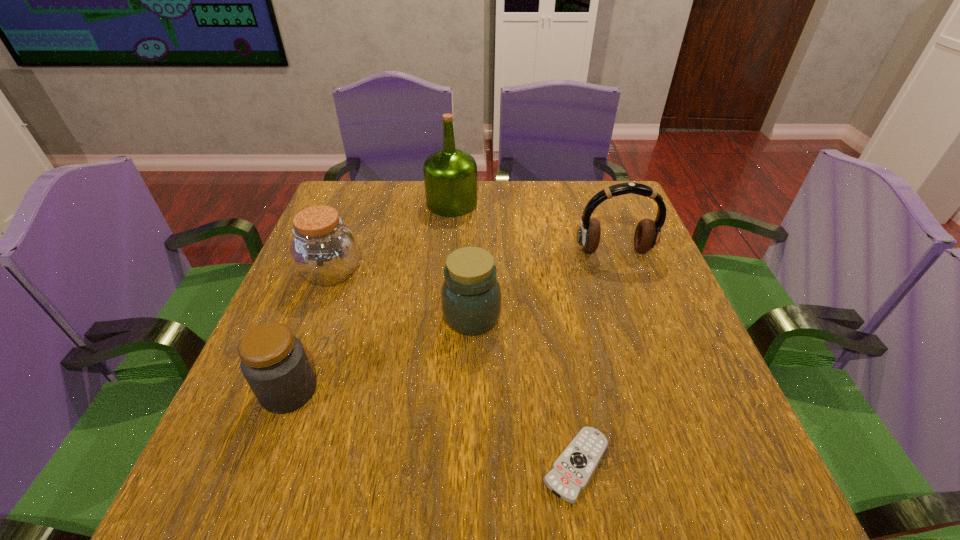
Where is `free spot located on the front of the tallest object`? free spot located on the front of the tallest object is located at coordinates (444, 286).

The height and width of the screenshot is (540, 960). Find the location of `free space located 0.200m on the ear cup of the second tallest object`. free space located 0.200m on the ear cup of the second tallest object is located at coordinates (638, 319).

Locate an element on the screen. The height and width of the screenshot is (540, 960). free location located 0.070m on the right of the farthest jar is located at coordinates (392, 273).

The image size is (960, 540). In order to click on free region located 0.300m on the right of the rightmost jar in this screenshot , I will do `click(639, 316)`.

Find the location of a particular element. vacant space situated 0.140m on the surface of the second nearest object near the warning symbol is located at coordinates (392, 391).

Where is `vacant space located 0.290m on the back of the remote control`? vacant space located 0.290m on the back of the remote control is located at coordinates (551, 308).

Locate an element on the screen. This screenshot has width=960, height=540. object positioned at the far edge is located at coordinates (450, 175).

What are the coordinates of `object that is positioned at the near edge` in the screenshot? It's located at (571, 472).

The width and height of the screenshot is (960, 540). Identify the location of object situated at the right edge. (647, 234).

Where is `vacant space at the far edge`? The height and width of the screenshot is (540, 960). vacant space at the far edge is located at coordinates (421, 218).